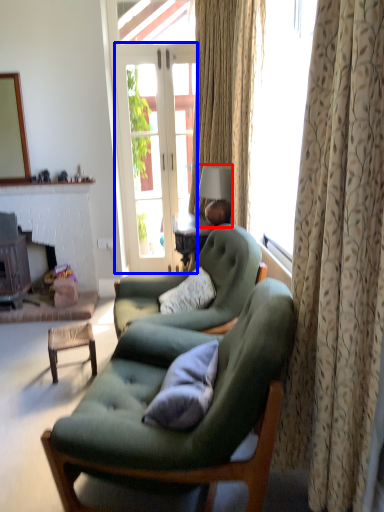
Question: Which object is closer to the camera taking this photo, lamp (highlighted by a red box) or screen door (highlighted by a blue box)?

Choices:
 (A) lamp
 (B) screen door

Answer: (A)